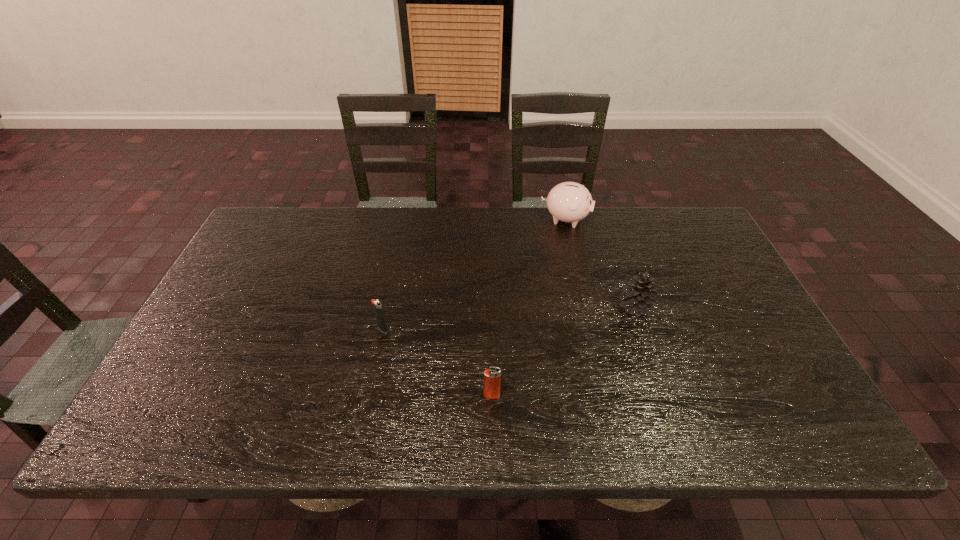
You are a GUI agent. You are given a task and a screenshot of the screen. Output one action in this format:
    pyautogui.click(x=<x>, y=<y>)
    Task: Click on the vacant area situated 0.060m on the right of the left igniter
    The image size is (960, 540).
    Given the screenshot: What is the action you would take?
    pyautogui.click(x=411, y=329)

This screenshot has height=540, width=960. In order to click on vacant area located 0.060m on the front of the nearer igniter in this screenshot , I will do `click(492, 423)`.

This screenshot has width=960, height=540. Identify the location of object that is at the far edge. (570, 202).

Image resolution: width=960 pixels, height=540 pixels. I want to click on free spot at the far edge of the desktop, so click(338, 234).

I want to click on vacant space at the near edge, so click(x=687, y=413).

This screenshot has height=540, width=960. In the image, there is a desktop. Identify the location of vacant space at the left edge. pyautogui.click(x=245, y=341).

Locate an element on the screen. This screenshot has width=960, height=540. vacant space at the right edge of the desktop is located at coordinates (745, 338).

Locate an element on the screen. This screenshot has width=960, height=540. blank area at the near right corner is located at coordinates (796, 413).

Locate an element on the screen. The image size is (960, 540). free space between the farthest object and the leftmost object is located at coordinates (474, 274).

At what (x,y) coordinates should I click in order to perform the action: click on empty space between the farthest object and the pinecone. Please return your answer as a coordinate pair (x, y). The width and height of the screenshot is (960, 540). Looking at the image, I should click on (600, 263).